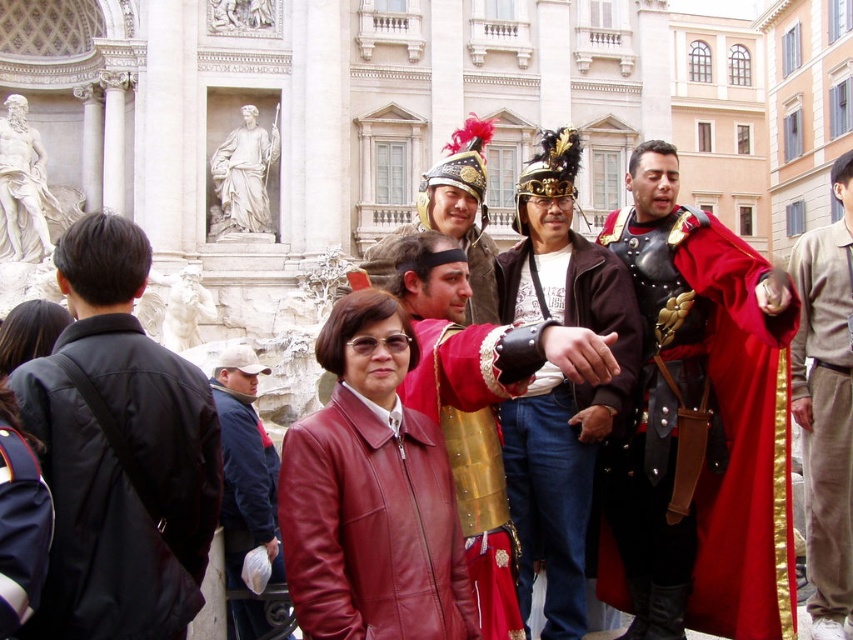
You are standing at the Trevi Fountain and want to take a photo of the point at coordinates point (291, 474). If your camera has a maximum range of 30 meters, will you be able to capture that point in your photo?

The point (291, 474) is 30.93 meters away from the viewer. Since the camera can only reach up to 30 meters, it is beyond the camera range. Therefore, you won